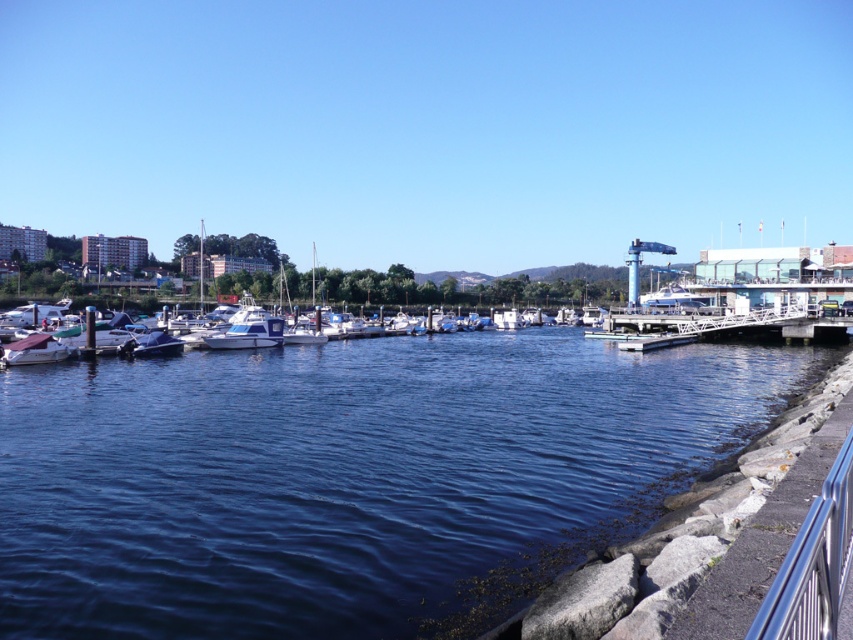
Who is higher up, blue water at center or satin silver railing at lower right?

Positioned higher is satin silver railing at lower right.

Does blue water at center have a lesser height compared to satin silver railing at lower right?

In fact, blue water at center may be taller than satin silver railing at lower right.

Where is `blue water at center`? This screenshot has width=853, height=640. blue water at center is located at coordinates (351, 477).

Does satin silver railing at lower right have a greater width compared to matte white boat at lower left?

In fact, satin silver railing at lower right might be narrower than matte white boat at lower left.

Which is below, satin silver railing at lower right or matte white boat at lower left?

satin silver railing at lower right

Locate an element on the screen. satin silver railing at lower right is located at coordinates (813, 564).

Between white glossy boat at center and matte white boat at lower left, which one has more height?

white glossy boat at center is taller.

Is white glossy boat at center thinner than matte white boat at lower left?

Incorrect, white glossy boat at center's width is not less than matte white boat at lower left's.

Which is in front, point (267, 324) or point (9, 349)?

Point (9, 349) is in front.

What are the coordinates of `white glossy boat at center` in the screenshot? It's located at (248, 332).